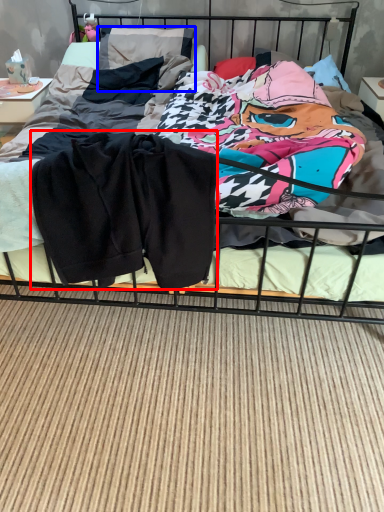
Question: Which object is further to the camera taking this photo, baby clothe (highlighted by a red box) or pillow (highlighted by a blue box)?

Choices:
 (A) baby clothe
 (B) pillow

Answer: (B)